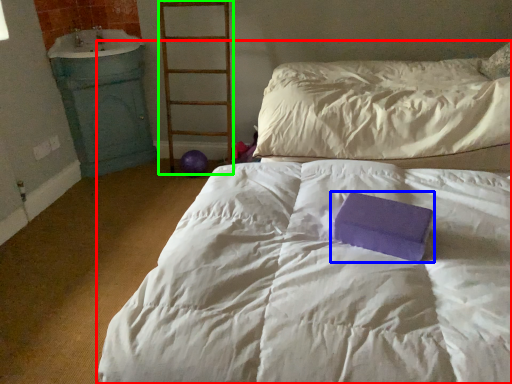
Question: Which is nearer to the bed (highlighted by a red box)? paperback book (highlighted by a blue box) or ladder (highlighted by a green box).

Choices:
 (A) paperback book
 (B) ladder

Answer: (A)